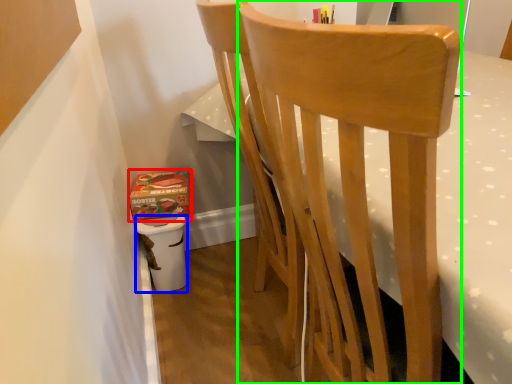
Question: Which object is the farthest from box (highlighted by a red box)? Choose among these: potty (highlighted by a blue box) or chair (highlighted by a green box).

Choices:
 (A) potty
 (B) chair

Answer: (B)